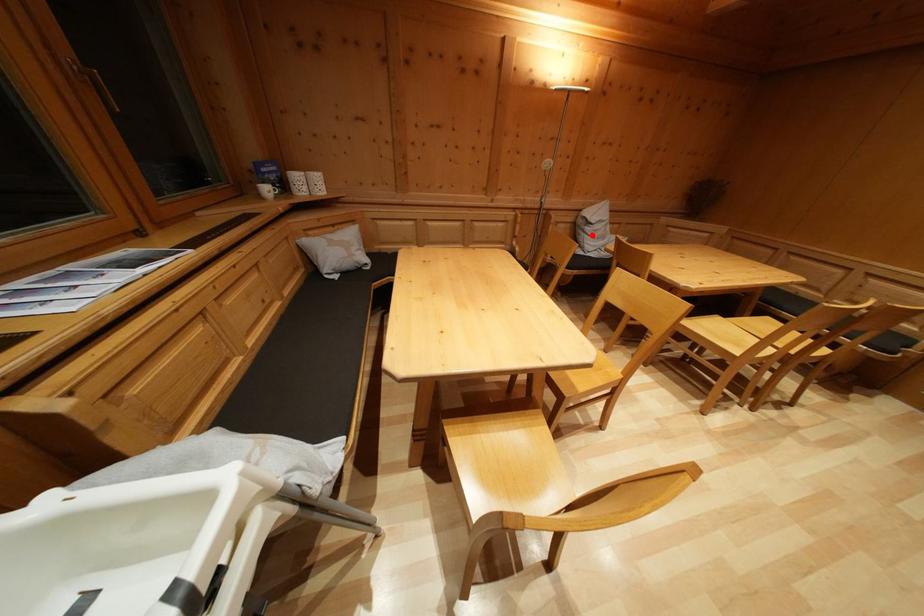
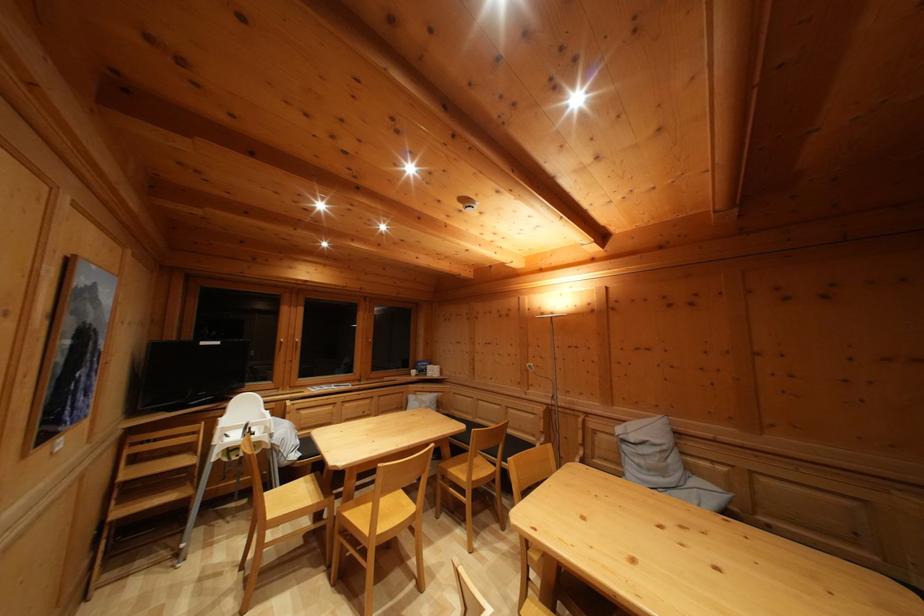
The point at the highlighted location is marked in the first image. Where is the corresponding point in the second image?

(629, 454)